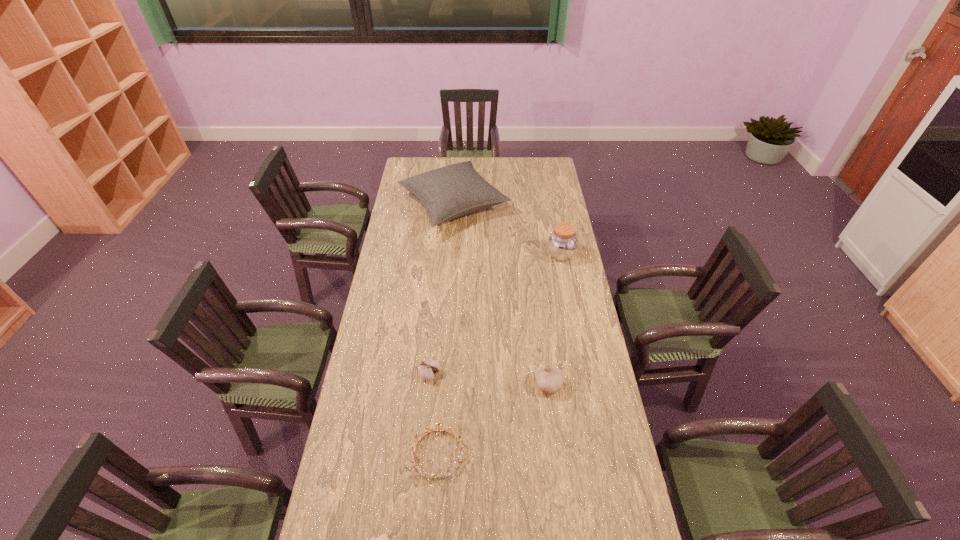
Find the location of a particular element. The width and height of the screenshot is (960, 540). vacant space positioned 0.330m on the back of the second object from right to left is located at coordinates (539, 306).

What are the coordinates of `free point located on the left of the left garlic` in the screenshot? It's located at coord(372,374).

I want to click on free space located 0.150m on the front-facing side of the second nearest object, so pyautogui.click(x=432, y=535).

Where is `object that is at the far edge`? The image size is (960, 540). object that is at the far edge is located at coordinates (449, 192).

Where is `object situated at the left edge`? object situated at the left edge is located at coordinates (449, 192).

Image resolution: width=960 pixels, height=540 pixels. I want to click on jar located in the right edge section of the desktop, so click(x=562, y=243).

Where is `garlic situated at the right edge`? The image size is (960, 540). garlic situated at the right edge is located at coordinates (549, 378).

Where is `object that is at the far left corner`? This screenshot has height=540, width=960. object that is at the far left corner is located at coordinates (449, 192).

Locate an element on the screen. vacant space at the far edge is located at coordinates (463, 159).

In the image, there is a desktop. Find the location of `vacant region at the left edge`. vacant region at the left edge is located at coordinates (413, 251).